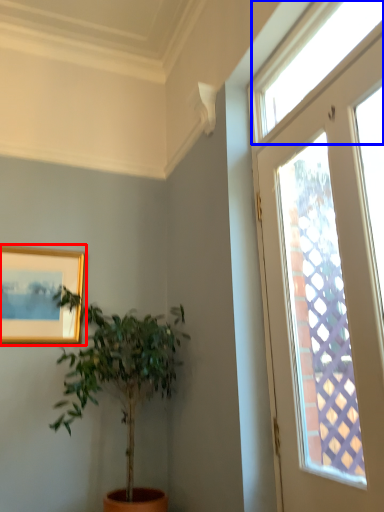
Question: Which object is closer to the camera taking this photo, picture frame (highlighted by a red box) or window (highlighted by a blue box)?

Choices:
 (A) picture frame
 (B) window

Answer: (B)